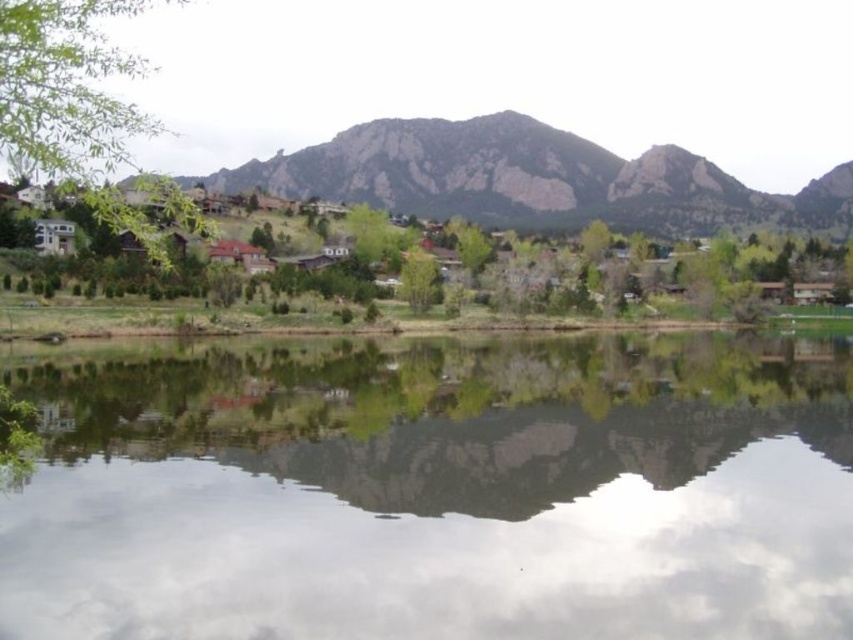
You are standing at the camera position and want to hike to the rugged brown mountain at center. If your average hiking speed is 3 miles per hour, how long would it take you to reach the mountain?

The distance between the rugged brown mountain at center and the camera is 1152.53 feet. Converting this distance to miles, 1152.53 feet is approximately 0.218 miles. At a speed of 3 miles per hour, the time required would be 0.218 miles divided by 3 mph, which equals approximately 0.0727 hours. Converting this to minutes, it would take roughly 4.36 minutes to reach the rugged brown mountain at center.

You are a photographer planning to capture the rugged brown mountain at center and the green leafy tree at left in a single frame. Considering their sizes, which object will occupy more space in your photo?

The rugged brown mountain at center will occupy more space in the photo because it has a larger size compared to the green leafy tree at left.

You are standing at the edge of the water and see two points in the scene. The first point is labeled as point [9,58] and the second as point [430,289]. Which point is closer to you?

Point [9,58] is closer to the viewer than point [430,289].